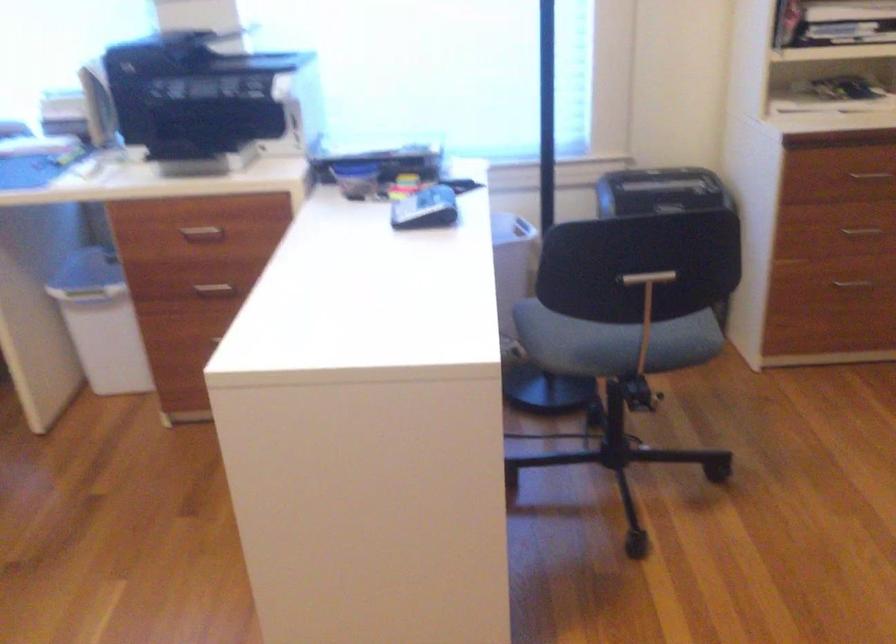
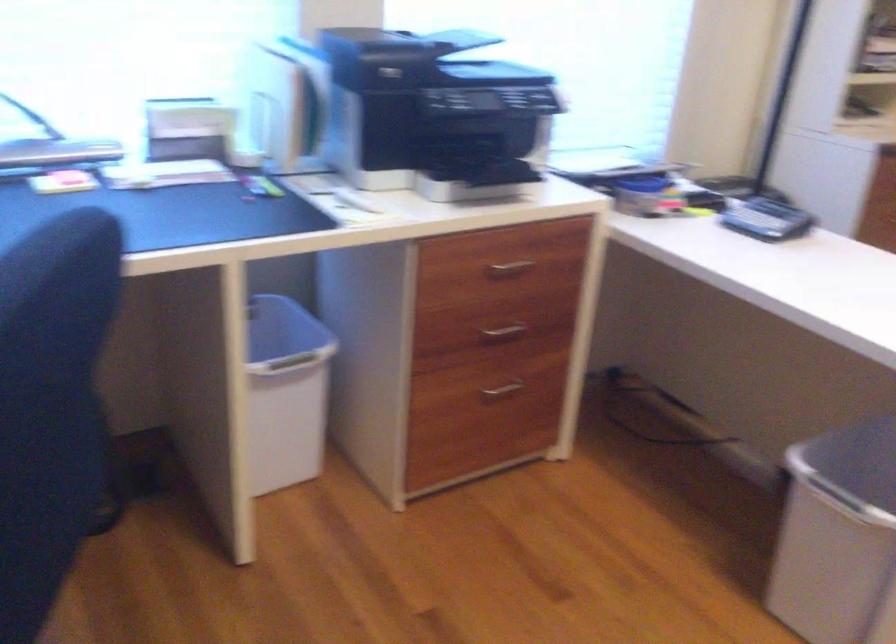
Locate, in the second image, the point that corresponds to pixel 423 204 in the first image.

(767, 220)